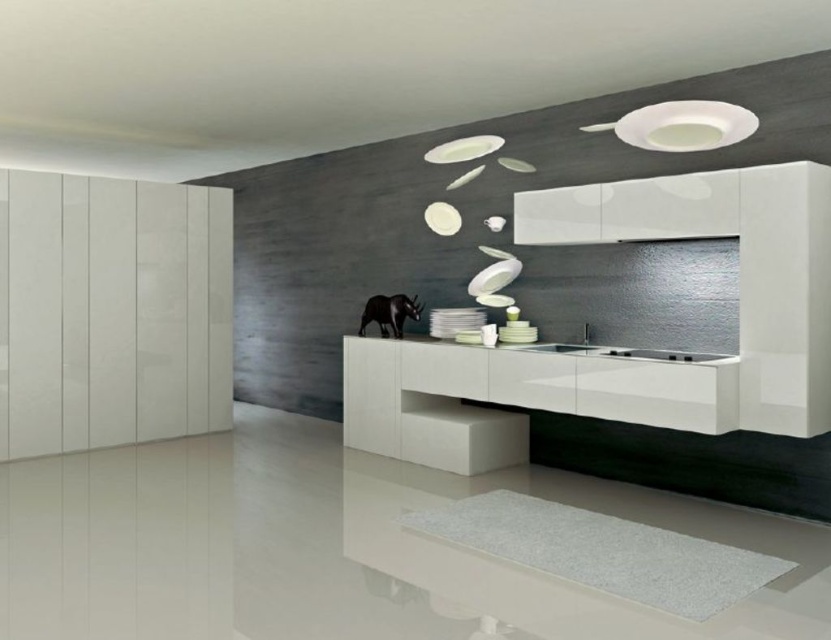
From the picture: Does glossy white vanity at center have a greater height compared to white matte stool at center?

Yes.

Does glossy white vanity at center appear over white matte stool at center?

Indeed, glossy white vanity at center is positioned over white matte stool at center.

The image size is (831, 640). What do you see at coordinates (514, 397) in the screenshot?
I see `glossy white vanity at center` at bounding box center [514, 397].

The height and width of the screenshot is (640, 831). I want to click on glossy white vanity at center, so click(x=514, y=397).

Who is shorter, glossy white vanity at center or white glossy sink at center?

white glossy sink at center

Does point (611, 396) lie in front of point (574, 349)?

That is True.

This screenshot has height=640, width=831. What are the coordinates of `glossy white vanity at center` in the screenshot? It's located at (514, 397).

Can you confirm if white matte stool at center is positioned to the left of white glossy sink at center?

Yes, white matte stool at center is to the left of white glossy sink at center.

Does white matte stool at center have a smaller size compared to white glossy sink at center?

Actually, white matte stool at center might be larger than white glossy sink at center.

Identify the location of white matte stool at center. The height and width of the screenshot is (640, 831). 465,438.

The height and width of the screenshot is (640, 831). I want to click on white matte stool at center, so click(x=465, y=438).